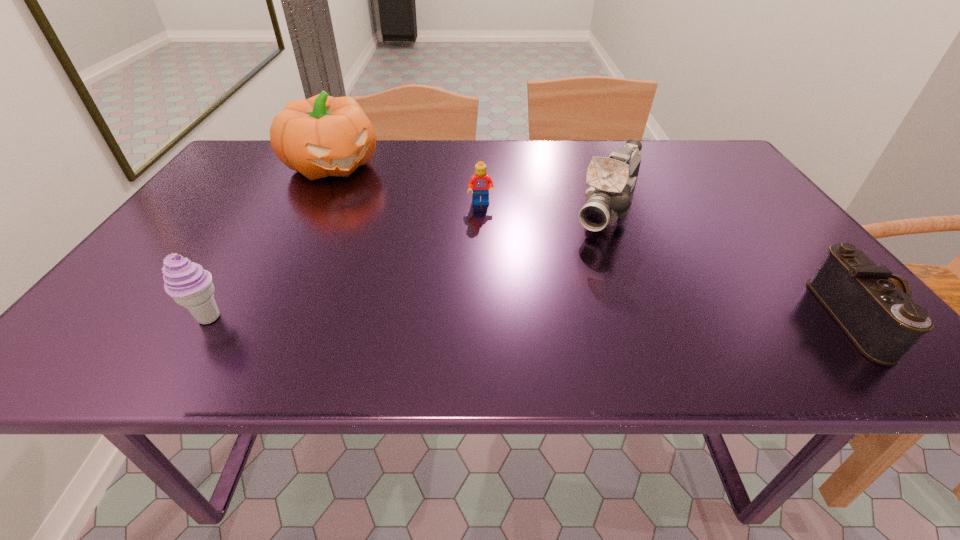
The height and width of the screenshot is (540, 960). Identify the location of free location at the far edge. (392, 164).

At what (x,y) coordinates should I click in order to perform the action: click on free space at the near edge of the desktop. Please return your answer as a coordinate pair (x, y). Image resolution: width=960 pixels, height=540 pixels. Looking at the image, I should click on (758, 296).

I want to click on free location at the left edge, so click(x=167, y=243).

Where is `free spot at the right edge of the desktop`? free spot at the right edge of the desktop is located at coordinates (770, 211).

At what (x,y) coordinates should I click in order to perform the action: click on empty space that is in between the camcorder and the third shortest object. Please return your answer as a coordinate pair (x, y). This screenshot has height=540, width=960. Looking at the image, I should click on (407, 264).

Identify the location of empty location between the pumpkin and the camera. (596, 241).

At what (x,y) coordinates should I click in order to perform the action: click on vacant area that lies between the rightmost object and the second object from right to left. Please return your answer as a coordinate pair (x, y). Looking at the image, I should click on (732, 264).

You are a GUI agent. You are given a task and a screenshot of the screen. Output one action in this format:
    pyautogui.click(x=<x>, y=<y>)
    Task: Click on the vacant space that's between the Lego and the fourth object from left to right
    Image resolution: width=960 pixels, height=540 pixels.
    Given the screenshot: What is the action you would take?
    pyautogui.click(x=543, y=207)

I want to click on free space between the camcorder and the third shortest object, so click(x=407, y=264).

Identify the location of free space between the camera and the camcorder. (732, 264).